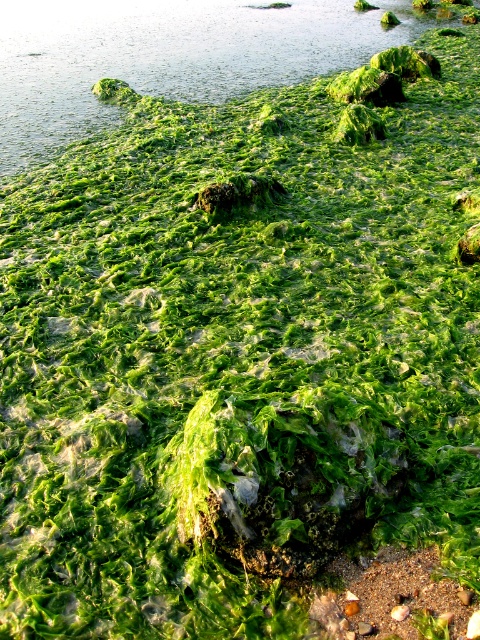
Question: Can you confirm if green algae at upper center is positioned above smooth brown sand at bottom right?

Choices:
 (A) yes
 (B) no

Answer: (A)

Question: Can you confirm if green algae at upper center is thinner than smooth brown sand at bottom right?

Choices:
 (A) yes
 (B) no

Answer: (B)

Question: Which of the following is the farthest from the observer?

Choices:
 (A) coord(456,608)
 (B) coord(88,45)

Answer: (B)

Question: Among these objects, which one is farthest from the camera?

Choices:
 (A) green algae at upper center
 (B) smooth brown sand at bottom right

Answer: (A)

Question: Is green algae at upper center closer to camera compared to smooth brown sand at bottom right?

Choices:
 (A) yes
 (B) no

Answer: (B)